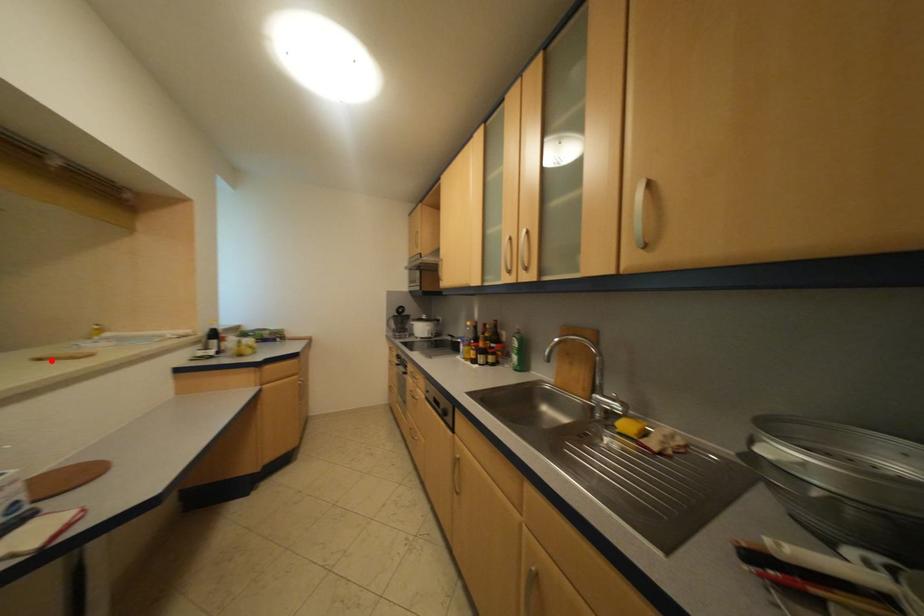
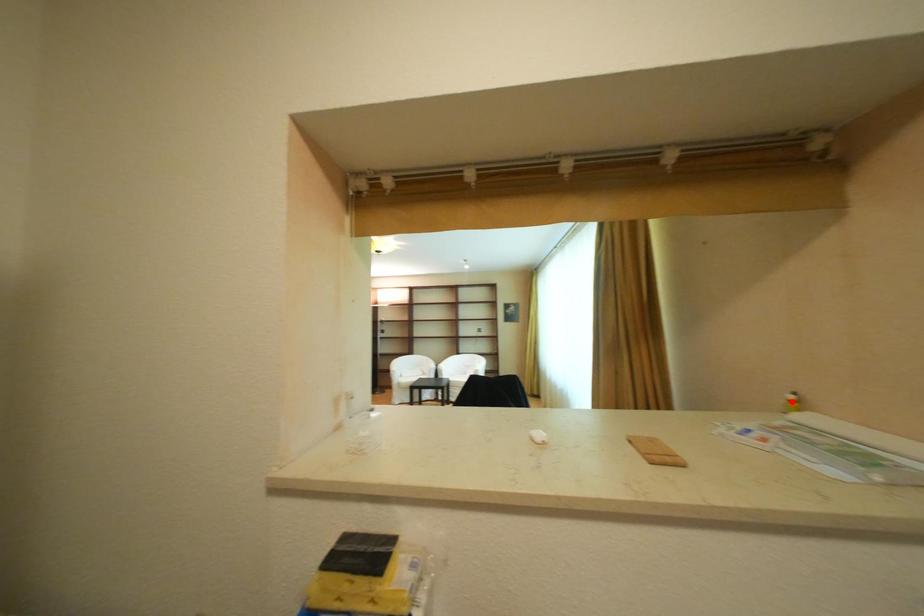
I am providing you with two images of the same scene from different viewpoints. A red point is marked on the first image and another point is marked on the second image. Does the point marked in image1 correspond to the same location as the one in image2?

No